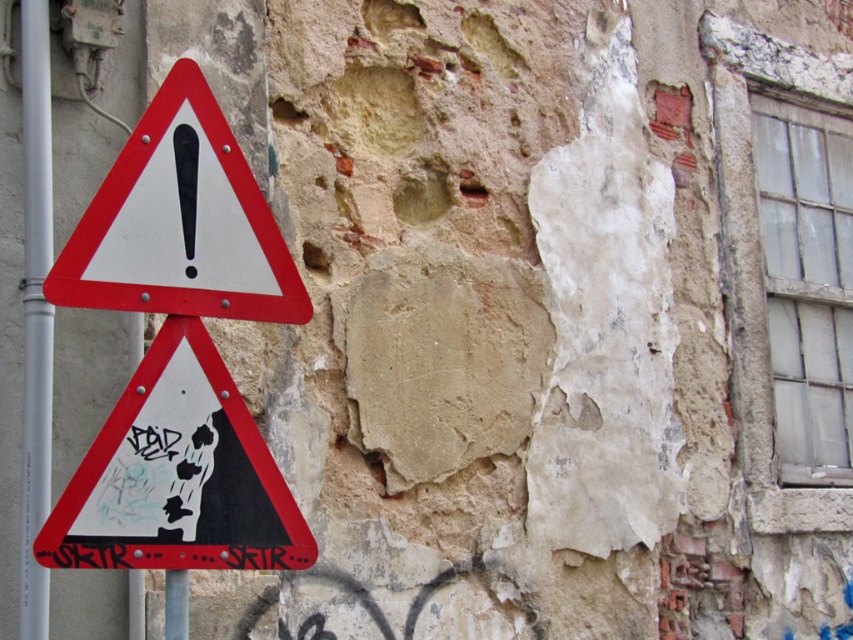
Question: Does red plastic triangle at left appear on the left side of metallic pole at left?

Choices:
 (A) no
 (B) yes

Answer: (A)

Question: Can you confirm if matte red triangle at left is positioned below red plastic triangle at left?

Choices:
 (A) yes
 (B) no

Answer: (A)

Question: Which object appears farthest from the camera in this image?

Choices:
 (A) metallic pole at left
 (B) matte red triangle at left
 (C) red plastic triangle at left

Answer: (A)

Question: Which object is closer to the camera taking this photo?

Choices:
 (A) red plastic triangle at left
 (B) metallic pole at left

Answer: (A)

Question: Does matte red triangle at left appear over red plastic triangle at left?

Choices:
 (A) no
 (B) yes

Answer: (A)

Question: Estimate the real-world distances between objects in this image. Which object is farther from the red plastic triangle at left?

Choices:
 (A) metallic pole at left
 (B) matte red triangle at left

Answer: (A)